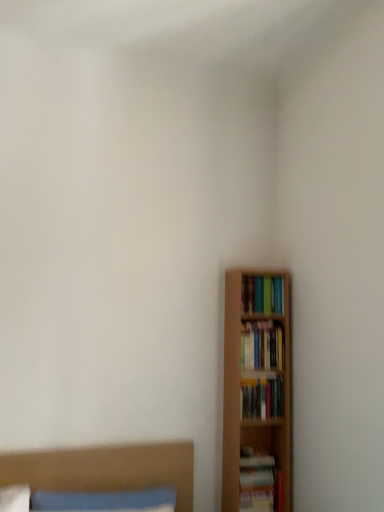
Question: Should I look upward or downward to see hardcover books at right, acting as the second book starting from the bottom?

Choices:
 (A) up
 (B) down

Answer: (B)

Question: Considering the relative sizes of matte green book at right, the fourth book when ordered from bottom to top, and hardcover books at right, which ranks as the 3th book in top-to-bottom order, in the image provided, is matte green book at right, the fourth book when ordered from bottom to top, wider than hardcover books at right, which ranks as the 3th book in top-to-bottom order,?

Choices:
 (A) no
 (B) yes

Answer: (B)

Question: Does matte green book at right, the fourth book when ordered from bottom to top, have a lesser width compared to hardcover books at right, acting as the second book starting from the bottom?

Choices:
 (A) yes
 (B) no

Answer: (B)

Question: From the image's perspective, is matte green book at right, placed as the 1th book when sorted from top to bottom, beneath hardcover books at right, which ranks as the 3th book in top-to-bottom order?

Choices:
 (A) no
 (B) yes

Answer: (A)

Question: Can you confirm if matte green book at right, the fourth book when ordered from bottom to top, is smaller than hardcover books at right, acting as the second book starting from the bottom?

Choices:
 (A) yes
 (B) no

Answer: (B)

Question: From a real-world perspective, is matte green book at right, the fourth book when ordered from bottom to top, positioned under hardcover books at right, which ranks as the 3th book in top-to-bottom order, based on gravity?

Choices:
 (A) yes
 (B) no

Answer: (B)

Question: Are matte green book at right, placed as the 1th book when sorted from top to bottom, and hardcover books at right, which ranks as the 3th book in top-to-bottom order, located far from each other?

Choices:
 (A) no
 (B) yes

Answer: (A)

Question: Considering the relative sizes of hardcover books at right, which ranks as the 3th book in top-to-bottom order, and hardcover books at right, which is the 2th book in top-to-bottom order, in the image provided, is hardcover books at right, which ranks as the 3th book in top-to-bottom order, bigger than hardcover books at right, which is the 2th book in top-to-bottom order,?

Choices:
 (A) yes
 (B) no

Answer: (B)

Question: From a real-world perspective, is hardcover books at right, which ranks as the 3th book in top-to-bottom order, on hardcover books at right, which is the 2th book in top-to-bottom order?

Choices:
 (A) yes
 (B) no

Answer: (B)

Question: Is hardcover books at right, acting as the second book starting from the bottom, shorter than hardcover books at right, placed as the third book when sorted from bottom to top?

Choices:
 (A) yes
 (B) no

Answer: (A)

Question: Is hardcover books at right, which ranks as the 3th book in top-to-bottom order, in front of hardcover books at right, placed as the third book when sorted from bottom to top?

Choices:
 (A) no
 (B) yes

Answer: (B)

Question: Can hardcover books at right, placed as the third book when sorted from bottom to top, be found inside hardcover books at right, which ranks as the 3th book in top-to-bottom order?

Choices:
 (A) no
 (B) yes

Answer: (A)

Question: From the image's perspective, is hardcover books at right, which ranks as the 3th book in top-to-bottom order, beneath hardcover books at right, which is the 2th book in top-to-bottom order?

Choices:
 (A) no
 (B) yes

Answer: (B)

Question: Considering the relative positions of hardcover books at right, which ranks as the 3th book in top-to-bottom order, and hardcover book at lower right, the 4th book from the top, in the image provided, is hardcover books at right, which ranks as the 3th book in top-to-bottom order, to the left of hardcover book at lower right, the 4th book from the top, from the viewer's perspective?

Choices:
 (A) yes
 (B) no

Answer: (B)